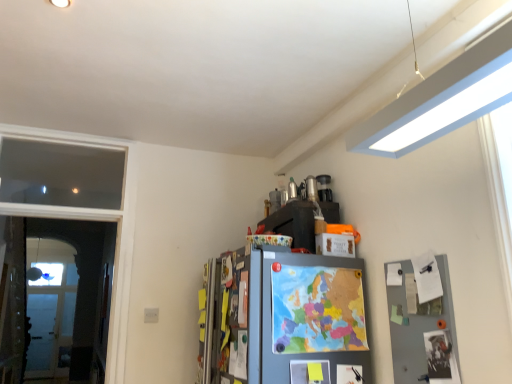
Question: Is clear glass screen door at left positioned far away from transparent glass window at left?

Choices:
 (A) no
 (B) yes

Answer: (B)

Question: Considering the relative sizes of clear glass screen door at left and transparent glass window at left in the image provided, is clear glass screen door at left taller than transparent glass window at left?

Choices:
 (A) yes
 (B) no

Answer: (A)

Question: Is clear glass screen door at left wider than transparent glass window at left?

Choices:
 (A) no
 (B) yes

Answer: (A)

Question: Can you confirm if clear glass screen door at left is thinner than transparent glass window at left?

Choices:
 (A) yes
 (B) no

Answer: (A)

Question: From a real-world perspective, is clear glass screen door at left positioned under transparent glass window at left based on gravity?

Choices:
 (A) no
 (B) yes

Answer: (B)

Question: Does clear glass screen door at left appear on the right side of transparent glass window at left?

Choices:
 (A) no
 (B) yes

Answer: (B)

Question: Can you confirm if transparent glass window at left is bigger than clear glass screen door at left?

Choices:
 (A) no
 (B) yes

Answer: (A)

Question: Would you say transparent glass window at left is outside clear glass screen door at left?

Choices:
 (A) no
 (B) yes

Answer: (B)

Question: Is transparent glass window at left closer to camera compared to clear glass screen door at left?

Choices:
 (A) no
 (B) yes

Answer: (A)

Question: Is transparent glass window at left smaller than clear glass screen door at left?

Choices:
 (A) no
 (B) yes

Answer: (B)

Question: Is clear glass screen door at left at the back of transparent glass window at left?

Choices:
 (A) yes
 (B) no

Answer: (B)

Question: Is transparent glass window at left aimed at clear glass screen door at left?

Choices:
 (A) yes
 (B) no

Answer: (A)

Question: Based on their sizes in the image, would you say clear glass screen door at left is bigger or smaller than transparent glass window at left?

Choices:
 (A) small
 (B) big

Answer: (B)